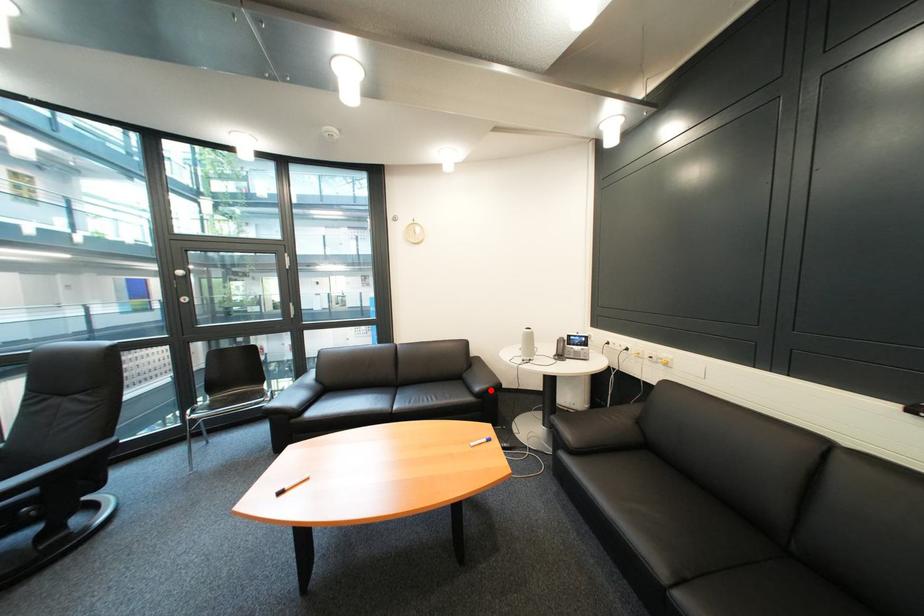
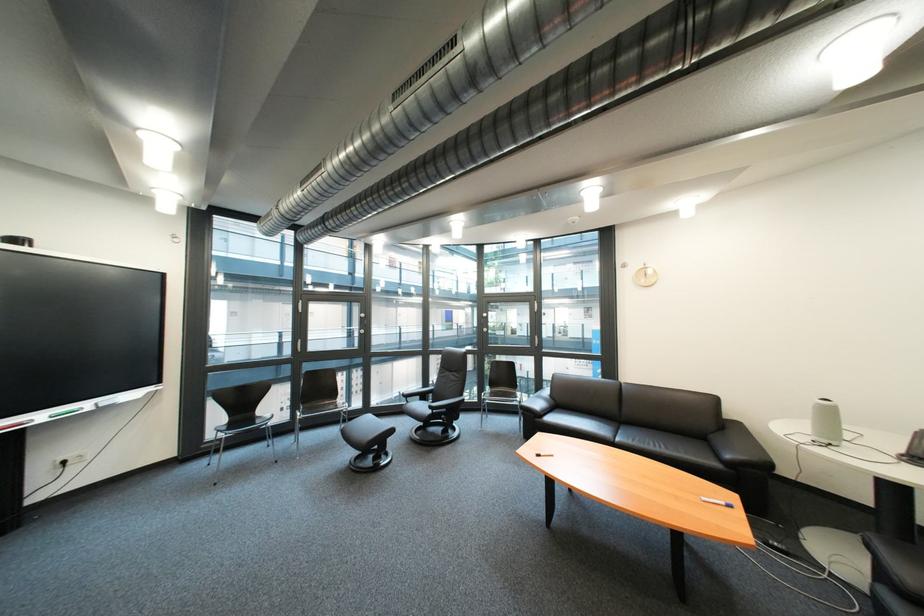
Where in the second image is the point corresponding to the highlighted location from the first image?

(742, 458)